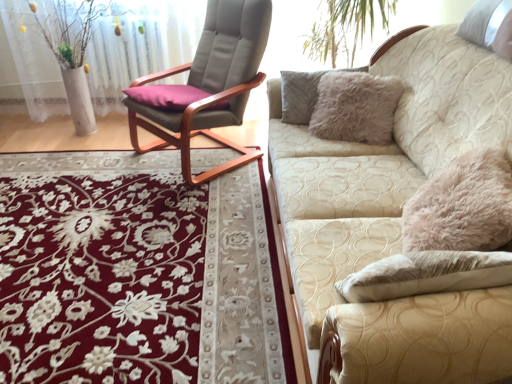
This screenshot has width=512, height=384. What are the coordinates of `floral carpet at center` in the screenshot? It's located at (100, 279).

Where is `white matte vase at left`? This screenshot has width=512, height=384. white matte vase at left is located at coordinates (141, 47).

The height and width of the screenshot is (384, 512). What do you see at coordinates (141, 47) in the screenshot? I see `white matte vase at left` at bounding box center [141, 47].

In the scene shown: Measure the distance between point (231, 96) and camera.

The distance of point (231, 96) from camera is 2.55 meters.

The height and width of the screenshot is (384, 512). Identify the location of floral carpet at center. (100, 279).

Between matte gray cushioned chair at center and white matte vase at left, which one has larger size?

With larger size is matte gray cushioned chair at center.

From the image's perspective, is matte gray cushioned chair at center beneath white matte vase at left?

Indeed, from the image's perspective, matte gray cushioned chair at center is shown beneath white matte vase at left.

From a real-world perspective, which object stands above the other?

Answer: matte gray cushioned chair at center is physically above.

Is matte gray cushioned chair at center positioned with its back to white matte vase at left?

No, matte gray cushioned chair at center's orientation is not away from white matte vase at left.

Does beige textured couch at right have a lesser width compared to matte gray cushioned chair at center?

No.

Considering the positions of objects beige textured couch at right and matte gray cushioned chair at center in the image provided, who is more to the right, beige textured couch at right or matte gray cushioned chair at center?

Positioned to the right is beige textured couch at right.

Can we say beige textured couch at right lies outside matte gray cushioned chair at center?

beige textured couch at right is positioned outside matte gray cushioned chair at center.

Considering the relative sizes of beige textured couch at right and matte gray cushioned chair at center in the image provided, is beige textured couch at right bigger than matte gray cushioned chair at center?

Correct, beige textured couch at right is larger in size than matte gray cushioned chair at center.

In terms of height, does beige textured couch at right look taller or shorter compared to white matte vase at left?

Considering their sizes, beige textured couch at right has less height than white matte vase at left.

Is beige textured couch at right facing away from white matte vase at left?

That's not correct — beige textured couch at right is not looking away from white matte vase at left.

What's the angular difference between beige textured couch at right and white matte vase at left's facing directions?

The facing directions of beige textured couch at right and white matte vase at left are 90.6 degrees apart.

Would you say beige textured couch at right is inside or outside white matte vase at left?

beige textured couch at right is spatially situated outside white matte vase at left.

Is floral carpet at center wider or thinner than matte gray cushioned chair at center?

Considering their sizes, floral carpet at center looks broader than matte gray cushioned chair at center.

The height and width of the screenshot is (384, 512). I want to click on flower lying below the matte gray cushioned chair at center (from the image's perspective), so click(100, 279).

Would you say floral carpet at center is outside matte gray cushioned chair at center?

Yes, floral carpet at center is not within matte gray cushioned chair at center.

Which object is closer to the camera taking this photo, floral carpet at center or matte gray cushioned chair at center?

floral carpet at center is more forward.

Between point (218, 45) and point (362, 328), which one is positioned in front?

The point (362, 328) is closer to the camera.

The height and width of the screenshot is (384, 512). In order to click on studio couch in front of the matte gray cushioned chair at center in this screenshot , I will do `click(393, 219)`.

Would you say matte gray cushioned chair at center is a long distance from beige textured couch at right?

No.

In the scene shown: Is beige textured couch at right inside matte gray cushioned chair at center?

No, beige textured couch at right is not inside matte gray cushioned chair at center.

Is white matte vase at left oriented towards beige textured couch at right?

No, white matte vase at left is not oriented towards beige textured couch at right.

Considering the points (29, 32) and (449, 100), which point is in front, point (29, 32) or point (449, 100)?

The point (449, 100) is more forward.

In the scene shown: Would you say white matte vase at left is inside or outside beige textured couch at right?

white matte vase at left exists outside the volume of beige textured couch at right.

Considering the relative sizes of white matte vase at left and beige textured couch at right in the image provided, is white matte vase at left wider than beige textured couch at right?

Incorrect, the width of white matte vase at left does not surpass that of beige textured couch at right.

I want to click on flower that appears below the white matte vase at left (from the image's perspective), so click(100, 279).

From a real-world perspective, which is physically below, white matte vase at left or floral carpet at center?

floral carpet at center is physically lower.

Considering the points (159, 23) and (167, 244), which point is in front, point (159, 23) or point (167, 244)?

The point (167, 244) is closer to the camera.

Which is correct: white matte vase at left is inside floral carpet at center, or outside of it?

white matte vase at left exists outside the volume of floral carpet at center.

Find the location of a particular element. The height and width of the screenshot is (384, 512). glass door beneath the matte gray cushioned chair at center (from a real-world perspective) is located at coordinates (141, 47).

At what (x,y) coordinates should I click in order to perform the action: click on chair above the beige textured couch at right (from the image's perspective). Please return your answer as a coordinate pair (x, y). The width and height of the screenshot is (512, 384). Looking at the image, I should click on (212, 84).

When comparing their distances from floral carpet at center, does beige textured couch at right or matte gray cushioned chair at center seem further?

The object further to floral carpet at center is beige textured couch at right.

Estimate the real-world distances between objects in this image. Which object is further from white matte vase at left, floral carpet at center or matte gray cushioned chair at center?

floral carpet at center.

Which object lies further to the anchor point matte gray cushioned chair at center, white matte vase at left or beige textured couch at right?

beige textured couch at right lies further to matte gray cushioned chair at center than the other object.

When comparing their distances from matte gray cushioned chair at center, does floral carpet at center or beige textured couch at right seem further?

Based on the image, floral carpet at center appears to be further to matte gray cushioned chair at center.

From the image, which object appears to be farther from floral carpet at center, matte gray cushioned chair at center or beige textured couch at right?

Based on the image, beige textured couch at right appears to be further to floral carpet at center.

Estimate the real-world distances between objects in this image. Which object is further from white matte vase at left, floral carpet at center or beige textured couch at right?

Based on the image, beige textured couch at right appears to be further to white matte vase at left.

Which object lies nearer to the anchor point white matte vase at left, matte gray cushioned chair at center or floral carpet at center?

matte gray cushioned chair at center.

When comparing their distances from beige textured couch at right, does floral carpet at center or white matte vase at left seem further?

white matte vase at left lies further to beige textured couch at right than the other object.

Find the location of `flower situated between white matte vase at left and beige textured couch at right from left to right`. flower situated between white matte vase at left and beige textured couch at right from left to right is located at coordinates (100, 279).

Where is `chair positioned between floral carpet at center and white matte vase at left from near to far`? This screenshot has height=384, width=512. chair positioned between floral carpet at center and white matte vase at left from near to far is located at coordinates (212, 84).

At what (x,y) coordinates should I click in order to perform the action: click on chair between beige textured couch at right and white matte vase at left along the z-axis. Please return your answer as a coordinate pair (x, y). Image resolution: width=512 pixels, height=384 pixels. Looking at the image, I should click on (x=212, y=84).

Locate an element on the screen. Image resolution: width=512 pixels, height=384 pixels. chair between floral carpet at center and beige textured couch at right is located at coordinates (212, 84).